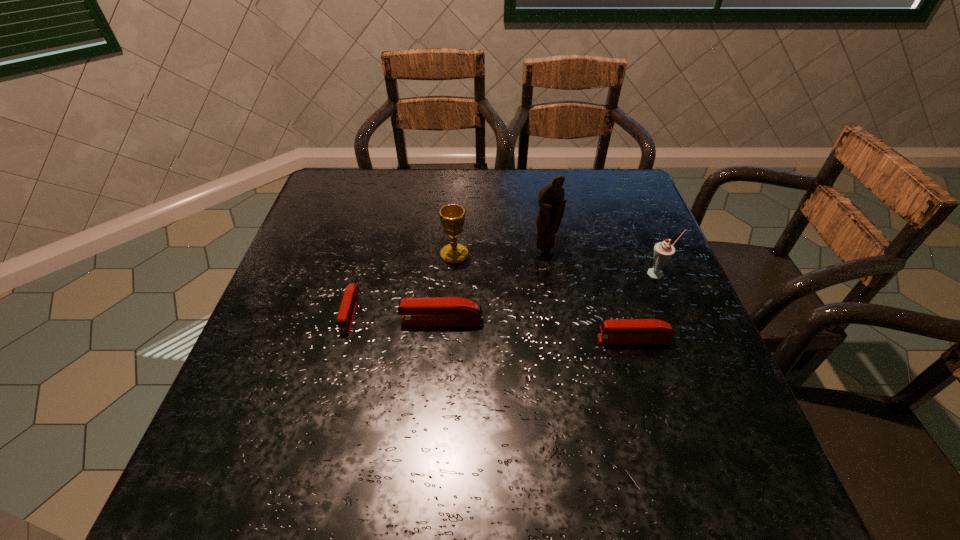
Locate an element on the screen. vacant position for inserting another stapler_(stapling_machine) evenly is located at coordinates (536, 330).